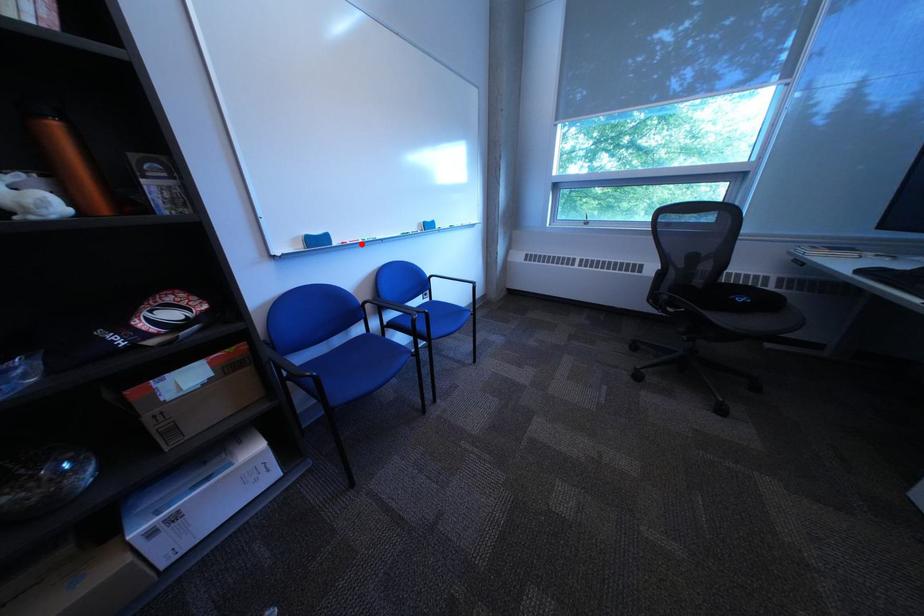
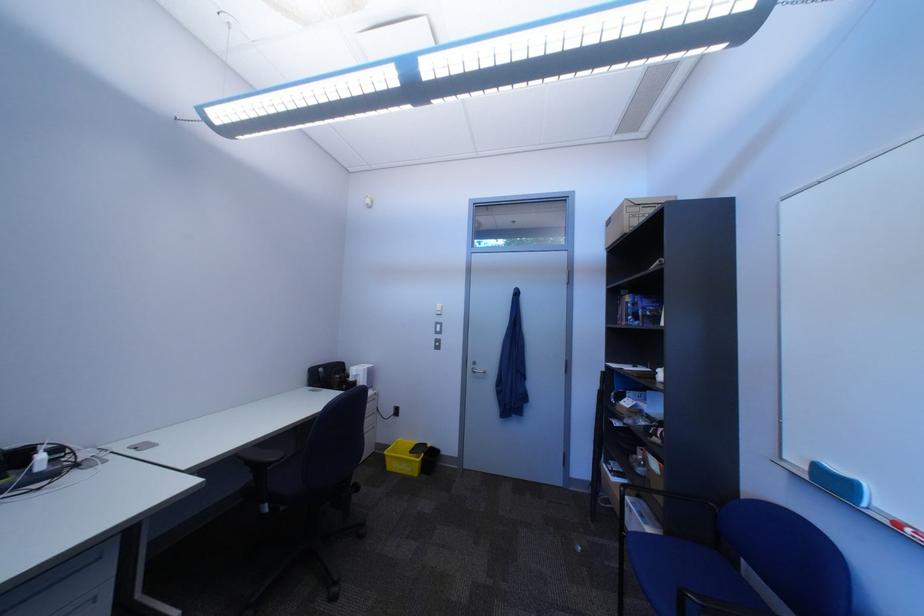
Locate, in the second image, the point that corresponds to the highlighted location in the first image.

(915, 527)